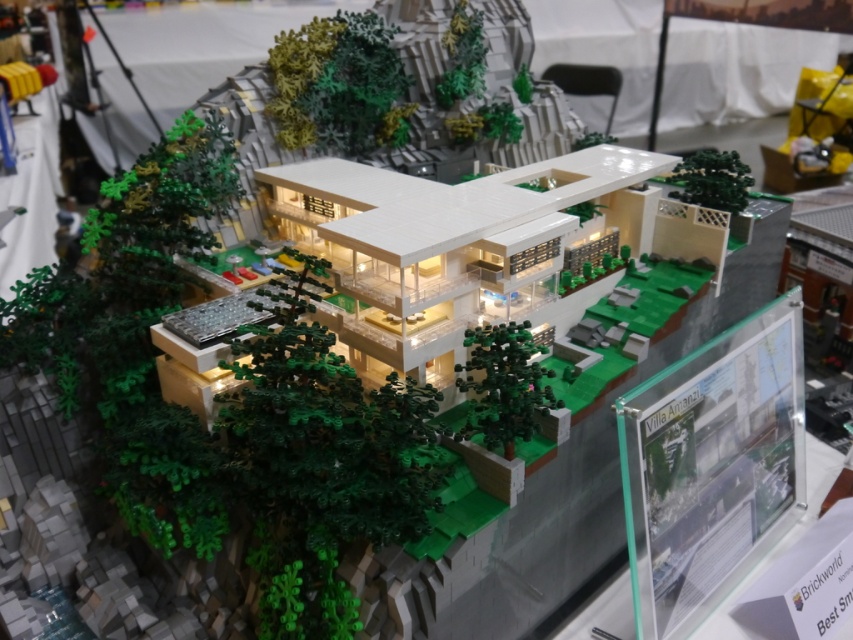
Does green matte tree at center lie in front of green matte tree at upper right?

Yes, it is in front of green matte tree at upper right.

Can you confirm if green matte tree at center is positioned above green matte tree at upper right?

No.

I want to click on green matte tree at center, so click(503, 385).

Can you confirm if green matte tree at upper center is bigger than green matte tree at center?

Yes, green matte tree at upper center is bigger than green matte tree at center.

Is green matte tree at upper center to the left of green matte tree at center from the viewer's perspective?

Indeed, green matte tree at upper center is positioned on the left side of green matte tree at center.

Is point (378, 93) behind point (498, 378)?

Yes, point (378, 93) is behind point (498, 378).

Find the location of a particular element. green matte tree at upper center is located at coordinates (339, 84).

Is green matte tree at upper center smaller than green matte tree at upper right?

Actually, green matte tree at upper center might be larger than green matte tree at upper right.

What do you see at coordinates (339, 84) in the screenshot?
I see `green matte tree at upper center` at bounding box center [339, 84].

I want to click on green matte tree at upper center, so click(339, 84).